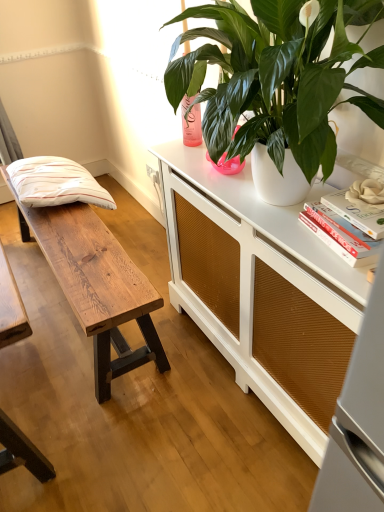
This screenshot has height=512, width=384. I want to click on free location in front of wooden bench at left, so click(x=104, y=412).